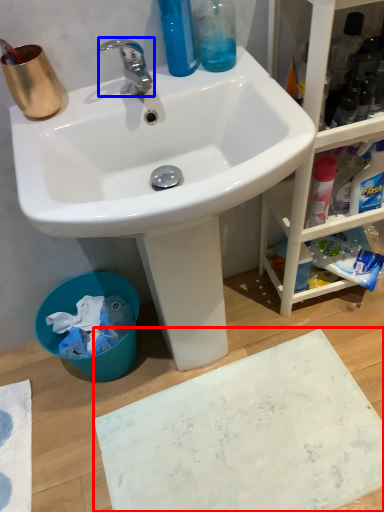
Question: Among these objects, which one is farthest to the camera, bath mat (highlighted by a red box) or tap (highlighted by a blue box)?

Choices:
 (A) bath mat
 (B) tap

Answer: (A)